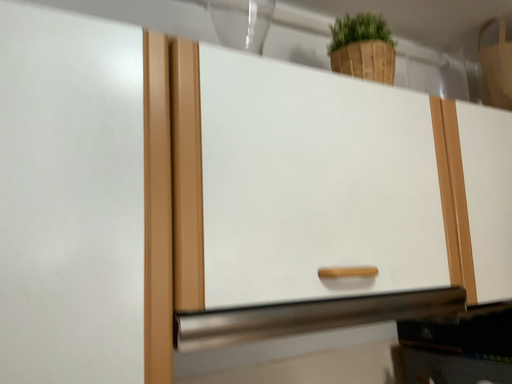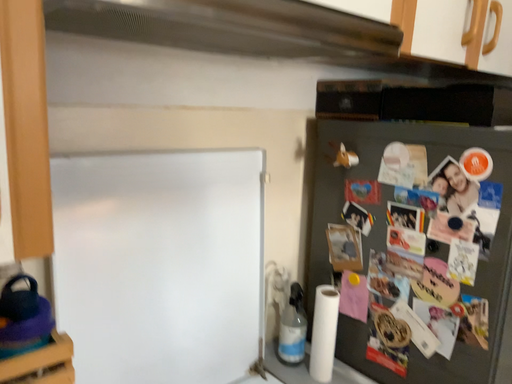
Question: How did the camera likely rotate when shooting the video?

Choices:
 (A) rotated downward
 (B) rotated upward

Answer: (A)